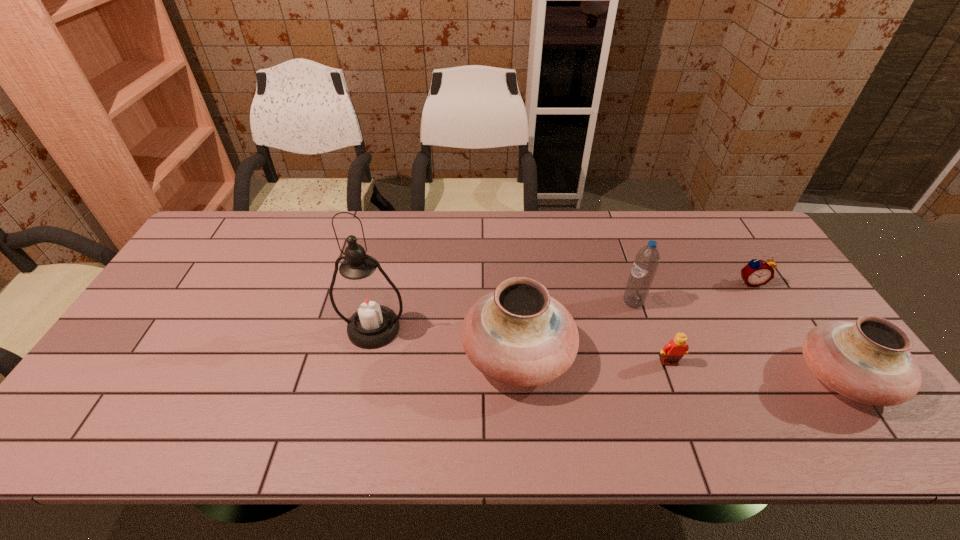
Locate an element on the screen. object that stands as the second closest to the farthest object is located at coordinates (647, 259).

Image resolution: width=960 pixels, height=540 pixels. I want to click on free spot that satisfies the following two spatial constraints: 1. on the face of the Lego; 2. on the left side of the shorter pottery, so click(675, 377).

Find the location of a particular element. Image resolution: width=960 pixels, height=540 pixels. free region that satisfies the following two spatial constraints: 1. on the face of the Lego; 2. on the right side of the third shortest object is located at coordinates (675, 377).